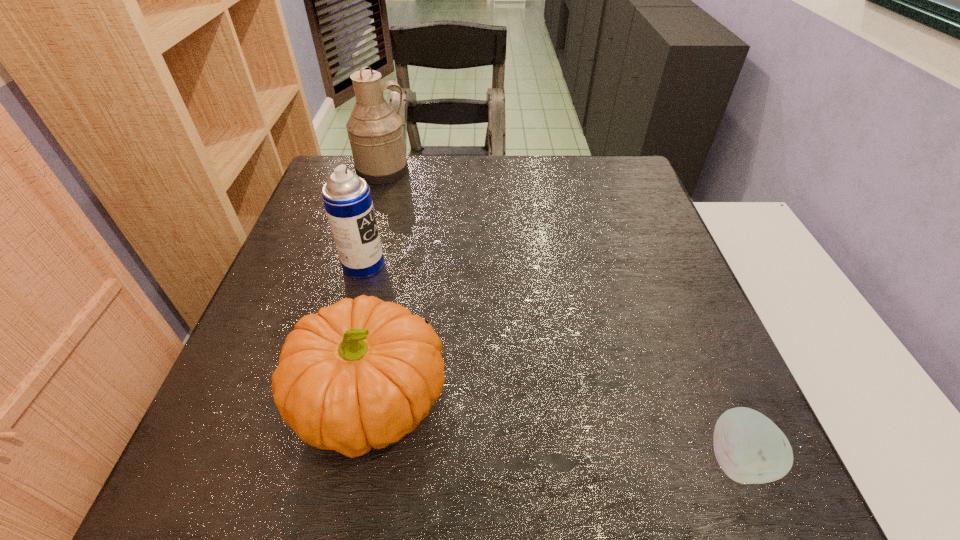
Where is `pitcher`? pitcher is located at coordinates (375, 132).

Find the location of a particular element. The height and width of the screenshot is (540, 960). aerosol can is located at coordinates (347, 199).

I want to click on pumpkin, so click(363, 373).

At what (x,y) coordinates should I click in order to perform the action: click on apple. Please return your answer as a coordinate pair (x, y). This screenshot has height=540, width=960. Looking at the image, I should click on (750, 449).

This screenshot has height=540, width=960. What are the coordinates of `the shortest object` in the screenshot? It's located at (750, 449).

Identify the location of free space located on the right of the pitcher. (476, 171).

The image size is (960, 540). Find the location of `vacant space positioned on the label side of the aerosol can`. vacant space positioned on the label side of the aerosol can is located at coordinates (542, 265).

In order to click on vacant space situated 0.110m on the surface of the pumpkin in this screenshot , I will do `click(513, 403)`.

Locate an element on the screen. vacant space located 0.390m on the back of the shortest object is located at coordinates click(x=657, y=266).

This screenshot has width=960, height=540. I want to click on object at the far edge, so click(375, 132).